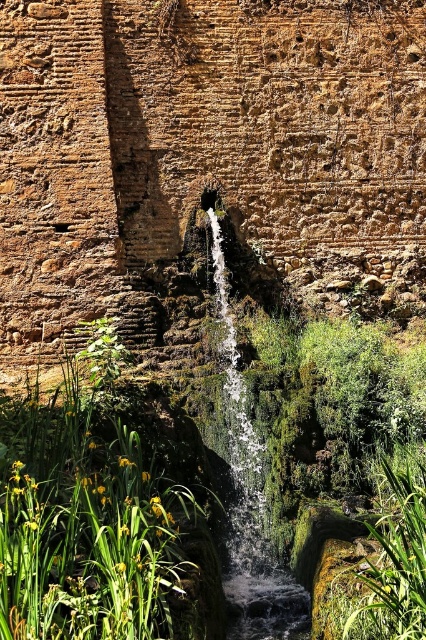
From the picture: You are standing at the base of the rocky wall and want to reach the point marked as point (2, 500). Which direction should you move relative to the point (379, 614) to get there?

To reach point (2, 500), you should move behind point (379, 614) since point (2, 500) is located behind point (379, 614) according to the spatial relationship provided.